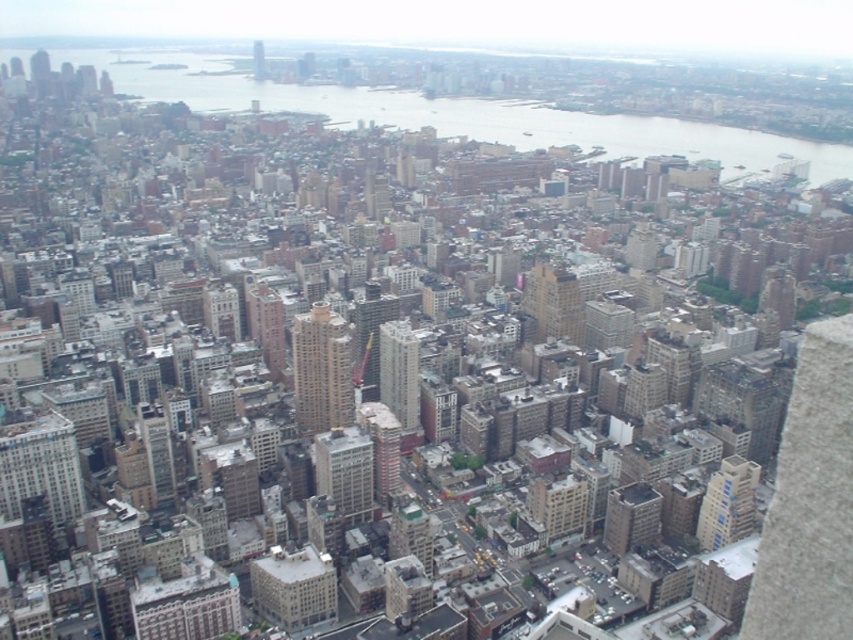
Question: Is the position of matte gray building at center less distant than that of smooth glass skyscraper at center?

Choices:
 (A) no
 (B) yes

Answer: (B)

Question: Does matte gray building at center appear over matte glass skyscraper at center?

Choices:
 (A) no
 (B) yes

Answer: (A)

Question: Which of these objects is positioned closest to the matte gray building at center?

Choices:
 (A) matte glass skyscraper at center
 (B) blue glass building at center-right

Answer: (A)

Question: Considering the real-world distances, which object is farthest from the smooth glass skyscraper at center?

Choices:
 (A) matte gray building at center
 (B) matte glass skyscraper at center
 (C) beige concrete building at center

Answer: (A)

Question: Considering the relative positions of beige concrete building at center and light beige concrete building at center in the image provided, where is beige concrete building at center located with respect to light beige concrete building at center?

Choices:
 (A) left
 (B) right

Answer: (A)

Question: Which of the following is the farthest from the observer?

Choices:
 (A) (721, 474)
 (B) (350, 520)
 (C) (525, 280)
 (D) (405, 380)

Answer: (A)